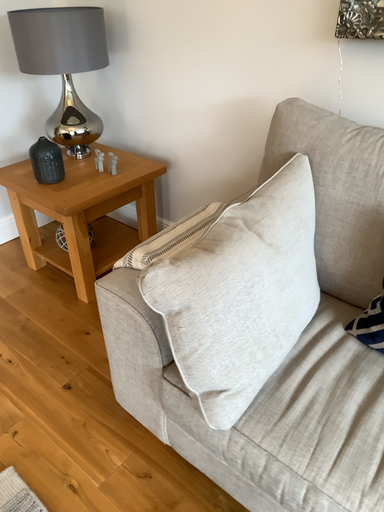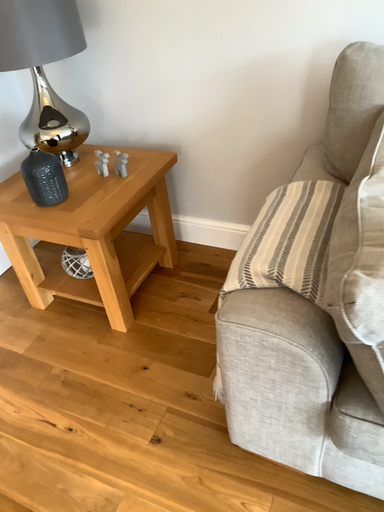
Question: Which way did the camera rotate in the video?

Choices:
 (A) rotated right
 (B) rotated left

Answer: (A)